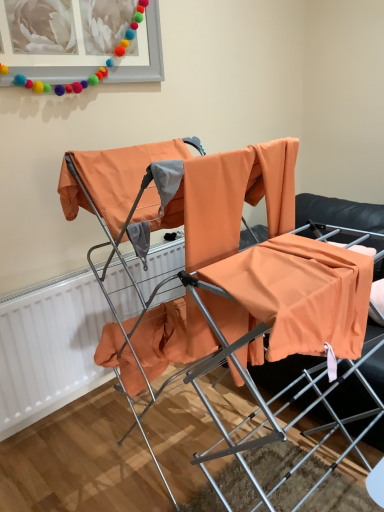
Describe the element at coordinates (50, 349) in the screenshot. I see `white matte radiator at left` at that location.

What are the coordinates of `matte gray picture frame at upper left` in the screenshot? It's located at (48, 57).

Is matte gray picture frame at upper left oriented towards orange fabric chair at center?

No, matte gray picture frame at upper left does not turn towards orange fabric chair at center.

From a real-world perspective, which object stands above the other?

matte gray picture frame at upper left, from a real-world perspective.

Which object is positioned more to the left, matte gray picture frame at upper left or orange fabric chair at center?

Positioned to the left is matte gray picture frame at upper left.

Can you confirm if orange fabric chair at center is smaller than white matte radiator at left?

No, orange fabric chair at center is not smaller than white matte radiator at left.

Is point (350, 328) positioned before point (19, 408)?

Yes, point (350, 328) is closer to viewer.

Does orange fabric chair at center have a lesser width compared to white matte radiator at left?

No, orange fabric chair at center is not thinner than white matte radiator at left.

Which is in front, white matte radiator at left or orange fabric chair at center?

orange fabric chair at center is more forward.

Can you tell me how much white matte radiator at left and orange fabric chair at center differ in facing direction?

The facing directions of white matte radiator at left and orange fabric chair at center are 92.3 degrees apart.

Considering the sizes of objects white matte radiator at left and orange fabric chair at center in the image provided, who is smaller, white matte radiator at left or orange fabric chair at center?

Smaller between the two is white matte radiator at left.

Does white matte radiator at left turn towards orange fabric chair at center?

Yes.

Is matte gray picture frame at upper left located outside white matte radiator at left?

That's correct, matte gray picture frame at upper left is outside of white matte radiator at left.

Between matte gray picture frame at upper left and white matte radiator at left, which one has smaller size?

With smaller size is matte gray picture frame at upper left.

Are matte gray picture frame at upper left and white matte radiator at left far apart?

Yes, matte gray picture frame at upper left and white matte radiator at left are located far from each other.

Is matte gray picture frame at upper left positioned before white matte radiator at left?

Yes, matte gray picture frame at upper left is closer to the viewer.

In the scene shown: Between orange fabric chair at center and matte gray picture frame at upper left, which one appears on the left side from the viewer's perspective?

Positioned to the left is matte gray picture frame at upper left.

Which object is more forward, orange fabric chair at center or matte gray picture frame at upper left?

orange fabric chair at center.

Can you confirm if orange fabric chair at center is taller than matte gray picture frame at upper left?

Yes.

Find the location of `picture frame lying above the white matte radiator at left (from the image's perspective)`. picture frame lying above the white matte radiator at left (from the image's perspective) is located at coordinates (48, 57).

Consider the image. Considering the positions of objects white matte radiator at left and matte gray picture frame at upper left in the image provided, who is more to the right, white matte radiator at left or matte gray picture frame at upper left?

white matte radiator at left.

Which is in front, point (5, 306) or point (8, 28)?

The point (8, 28) is closer to the camera.

Is white matte radiator at left not within matte gray picture frame at upper left?

white matte radiator at left is positioned outside matte gray picture frame at upper left.

Locate an element on the screen. This screenshot has height=512, width=384. picture frame that appears on the left of orange fabric chair at center is located at coordinates (48, 57).

At what (x,y) coordinates should I click in order to perform the action: click on chair that is on the right side of white matte radiator at left. Please return your answer as a coordinate pair (x, y). Looking at the image, I should click on (221, 260).

From the image, which object appears to be nearer to orange fabric chair at center, matte gray picture frame at upper left or white matte radiator at left?

The object closer to orange fabric chair at center is white matte radiator at left.

Based on their spatial positions, is orange fabric chair at center or white matte radiator at left closer to matte gray picture frame at upper left?

The object closer to matte gray picture frame at upper left is orange fabric chair at center.

Considering their positions, is orange fabric chair at center positioned closer to white matte radiator at left than matte gray picture frame at upper left?

Based on the image, orange fabric chair at center appears to be nearer to white matte radiator at left.

Looking at the image, which one is located closer to white matte radiator at left, matte gray picture frame at upper left or orange fabric chair at center?

orange fabric chair at center is closer to white matte radiator at left.

From the image, which object appears to be nearer to matte gray picture frame at upper left, white matte radiator at left or orange fabric chair at center?

Based on the image, orange fabric chair at center appears to be nearer to matte gray picture frame at upper left.

Considering their positions, is white matte radiator at left positioned closer to orange fabric chair at center than matte gray picture frame at upper left?

Among the two, white matte radiator at left is located nearer to orange fabric chair at center.

Locate an element on the screen. The width and height of the screenshot is (384, 512). chair that lies between matte gray picture frame at upper left and white matte radiator at left from top to bottom is located at coordinates (221, 260).